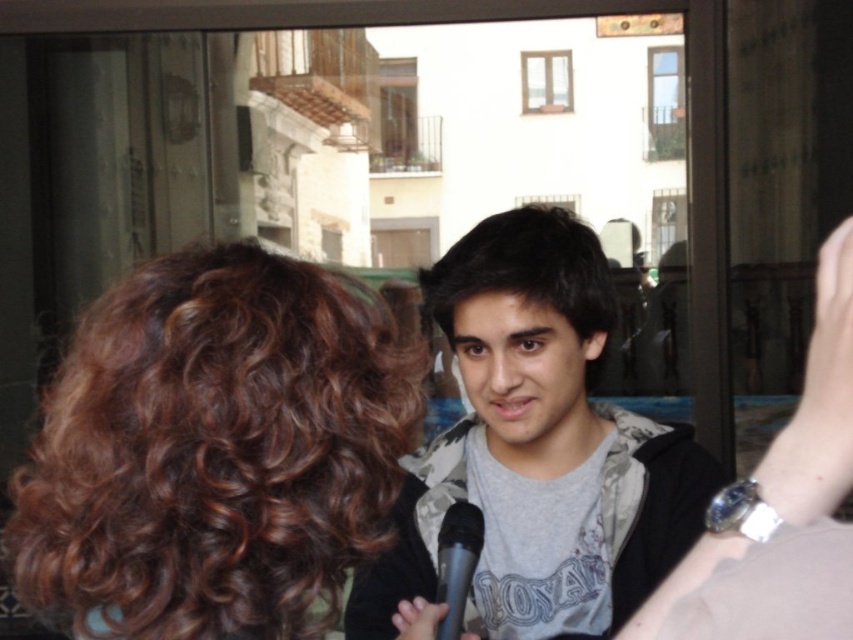
You are a photographer standing in front of the two people in the image. You want to take a photo that clearly shows both the gray cotton shirt at center and the dark brown hair at center. Which object should you focus on first to ensure both are in sharp focus?

You should focus on the gray cotton shirt at center first because it is closer to the viewer than the dark brown hair at center. By focusing on the closer object, the farther one will still be in focus due to the depth of field.

You are a photographer adjusting your camera to focus on the two points in the scene. The first point is labeled as point (x=505, y=374) and the second is point (x=515, y=282). Which point should you focus on first if you want to capture both points in the same plane of focus?

Point (x=515, y=282) should be focused on first because it is closer to the camera than point (x=505, y=374), which is behind it. By focusing on the closer point, the depth of field may include both points in the same plane of focus.